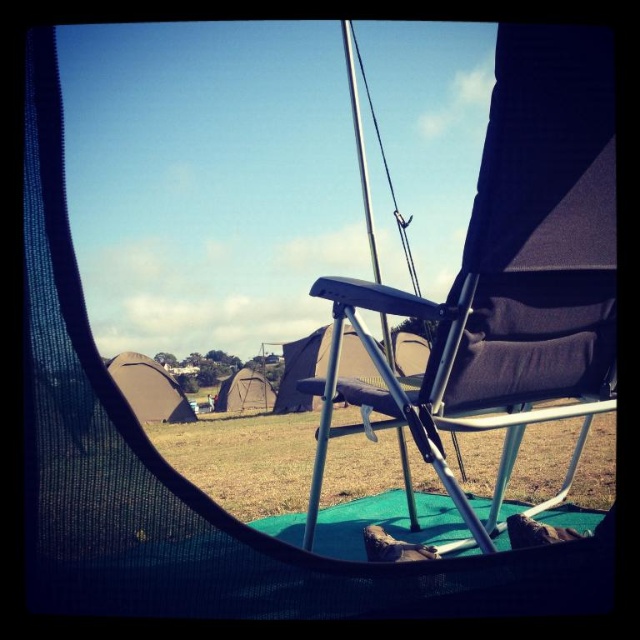
You are planning to set up a campsite and have limited space between two trees. You need to place both the dark blue fabric beach chair at center and the dark gray canvas tent at center. Based on their sizes, which object should you place first to ensure they both fit?

The dark blue fabric beach chair at center is narrower than the dark gray canvas tent at center. Place the wider dark gray canvas tent at center first to accommodate the narrower chair afterward.

You are setting up a campsite and need to place the dark blue fabric beach chair at center and the brown canvas tent at center. Given that the space between them is 2 meters wide, can both items fit side by side without overlapping?

The dark blue fabric beach chair at center has a smaller width than the brown canvas tent at center. Since the space between them is 2 meters wide, both items can fit side by side without overlapping as long as their combined widths do not exceed 2 meters. However, the exact dimensions are not provided, so it depends on their individual sizes.